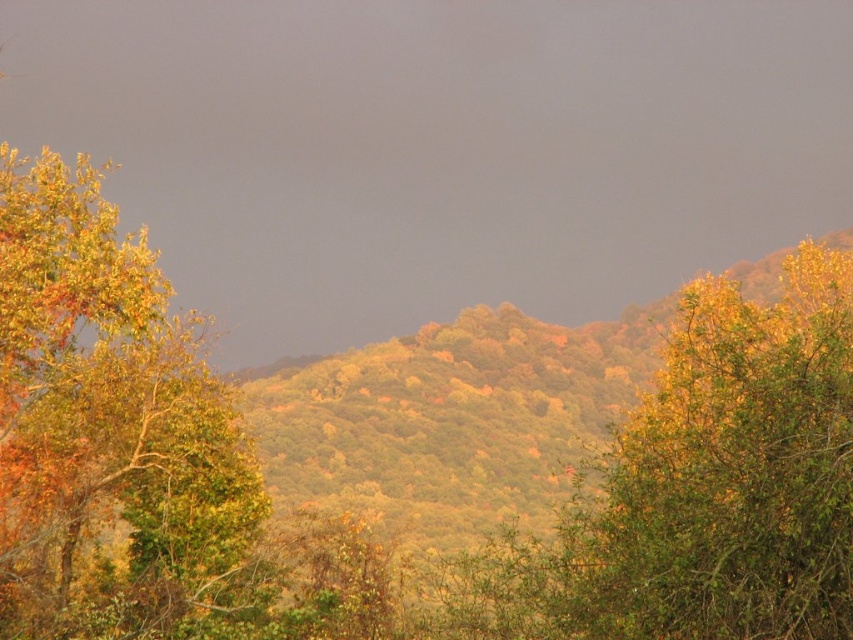
Who is shorter, green leafy tree at center or golden foliage tree at left?

Standing shorter between the two is green leafy tree at center.

Between point (824, 358) and point (59, 365), which one is positioned behind?

Positioned behind is point (59, 365).

Where is `green leafy tree at center`? This screenshot has width=853, height=640. green leafy tree at center is located at coordinates (701, 486).